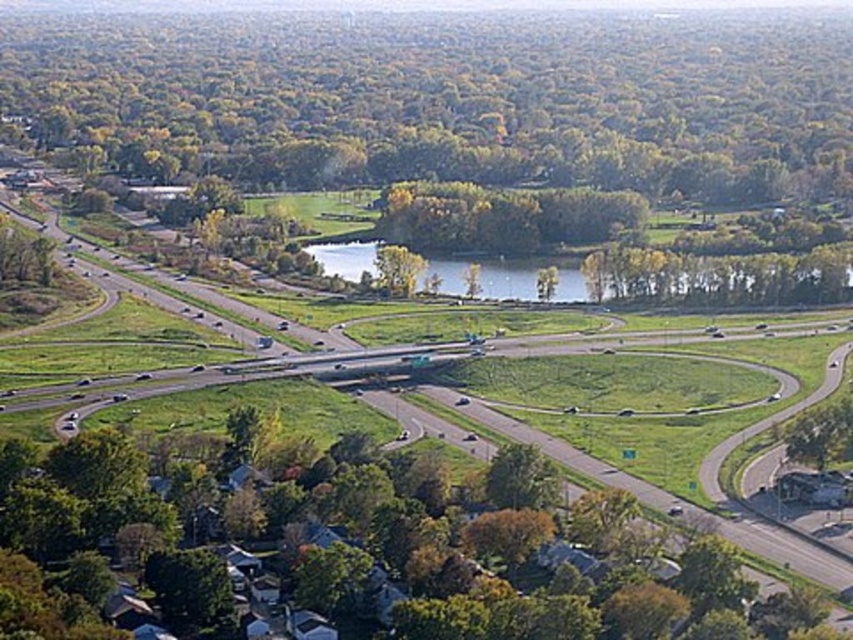
Question: Which of the following is the closest to the observer?

Choices:
 (A) (321, 570)
 (B) (312, 252)

Answer: (A)

Question: Which point is farther from the camera taking this photo?

Choices:
 (A) (737, 554)
 (B) (525, 282)

Answer: (B)

Question: Does green leafy tree at lower center appear on the left side of green grassy lake at center?

Choices:
 (A) no
 (B) yes

Answer: (B)

Question: Is green leafy tree at lower center thinner than green grassy lake at center?

Choices:
 (A) no
 (B) yes

Answer: (B)

Question: Which of the following is the closest to the observer?

Choices:
 (A) green grassy lake at center
 (B) green leafy tree at lower center

Answer: (B)

Question: Is the position of green leafy tree at lower center less distant than that of green grassy lake at center?

Choices:
 (A) no
 (B) yes

Answer: (B)